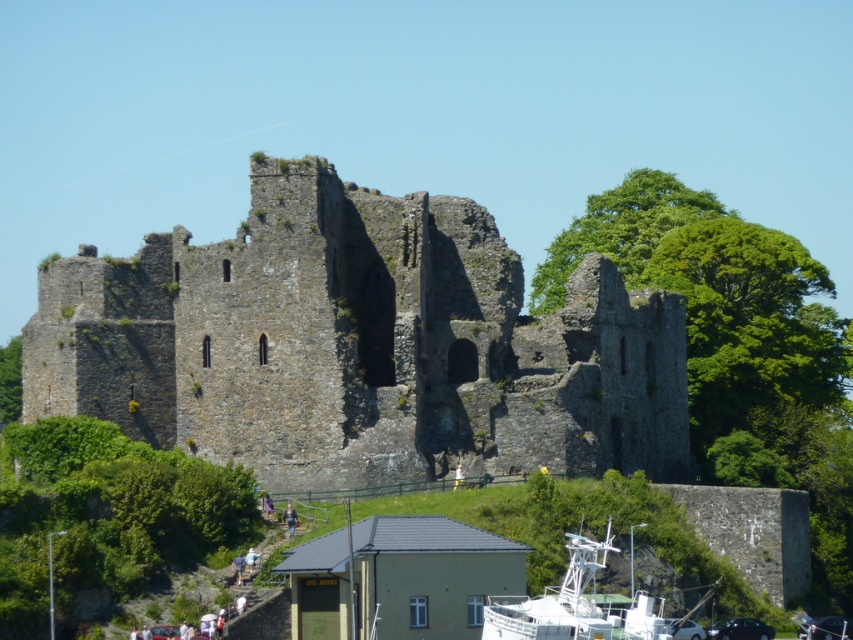
Who is higher up, rough stone castle at center or white plastic boat at lower right?

Positioned higher is rough stone castle at center.

How far apart are rough stone castle at center and white plastic boat at lower right?

rough stone castle at center is 61.48 feet away from white plastic boat at lower right.

This screenshot has height=640, width=853. Describe the element at coordinates (358, 346) in the screenshot. I see `rough stone castle at center` at that location.

The image size is (853, 640). What are the coordinates of `rough stone castle at center` in the screenshot? It's located at (358, 346).